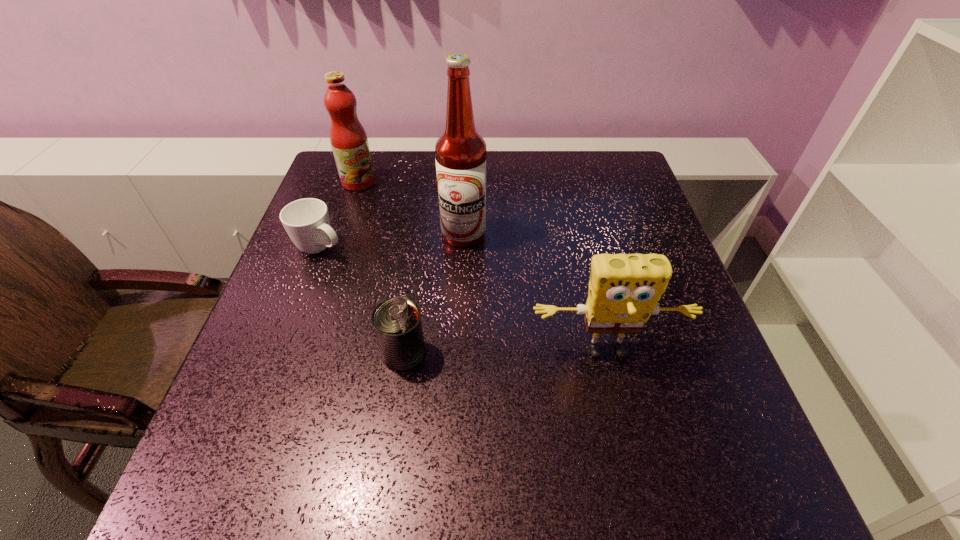
I want to click on free space at the far right corner, so click(608, 190).

The height and width of the screenshot is (540, 960). In order to click on vacant space that is in between the alcohol and the second shortest object in this screenshot , I will do `click(434, 293)`.

I want to click on unoccupied position between the second shortest object and the alcohol, so click(434, 293).

You are a GUI agent. You are given a task and a screenshot of the screen. Output one action in this format:
    pyautogui.click(x=<x>, y=<y>)
    Task: Click on the vacant area between the sponge and the can
    This screenshot has height=540, width=960.
    Given the screenshot: What is the action you would take?
    pyautogui.click(x=505, y=353)

Locate an element on the screen. The height and width of the screenshot is (540, 960). free area in between the fruit juice and the fourth tallest object is located at coordinates (381, 267).

Where is `free space between the rightmost object and the farthest object`? The image size is (960, 540). free space between the rightmost object and the farthest object is located at coordinates (483, 267).

Identify the location of empty space between the third object from right to left and the tallest object. The image size is (960, 540). (434, 293).

Where is `free space between the rightmost object and the alcohol`? free space between the rightmost object and the alcohol is located at coordinates (536, 293).

Image resolution: width=960 pixels, height=540 pixels. What are the coordinates of `free space between the farthest object and the fourth object from left to right` in the screenshot? It's located at (411, 208).

Identify the location of free space between the fourth object from left to right and the second tallest object. (411, 208).